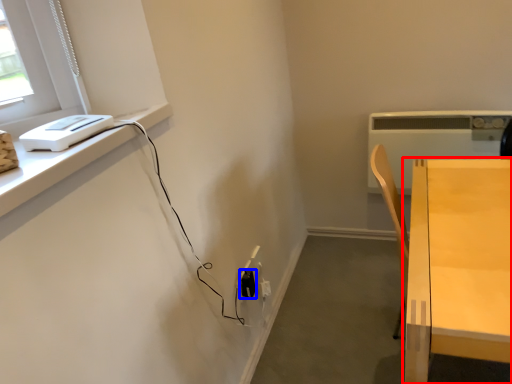
Question: Among these objects, which one is nearest to the camera, table (highlighted by a red box) or electric outlet (highlighted by a blue box)?

Choices:
 (A) table
 (B) electric outlet

Answer: (A)